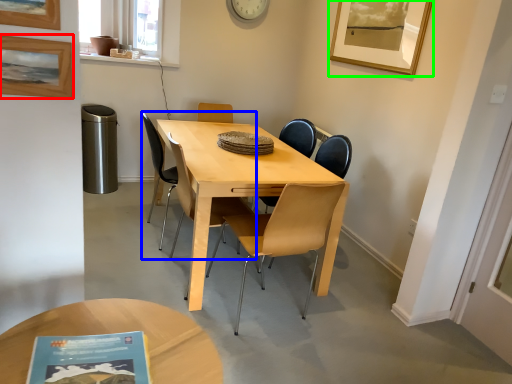
Question: Considering the real-world distances, which object is closest to picture frame (highlighted by a red box)? chair (highlighted by a blue box) or picture frame (highlighted by a green box).

Choices:
 (A) chair
 (B) picture frame

Answer: (A)